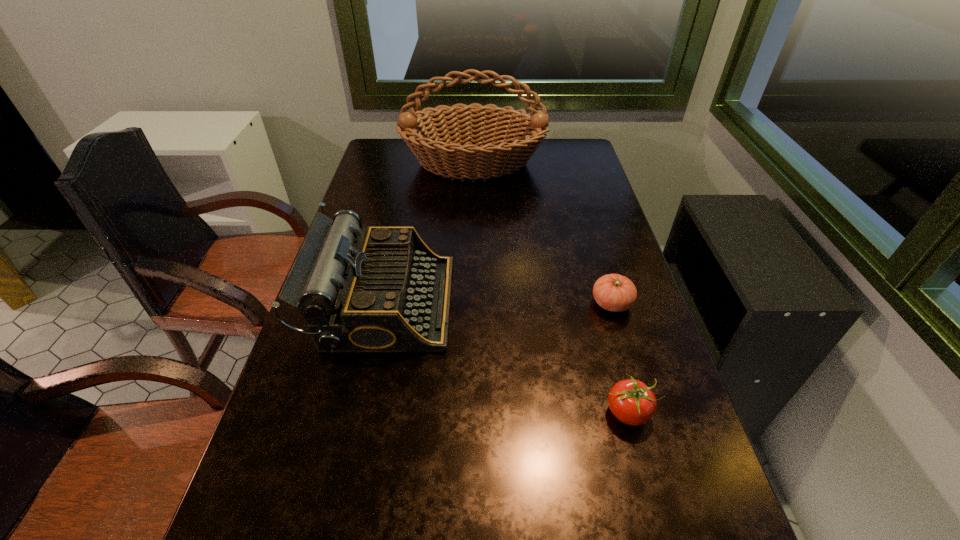
Identify the location of vacant region that satisfies the following two spatial constraints: 1. on the keyboard of the farther tomato; 2. on the right side of the typewriter. The image size is (960, 540). (383, 303).

The width and height of the screenshot is (960, 540). Find the location of `vacant space that satisfies the following two spatial constraints: 1. on the front side of the basket; 2. on the right side of the farther tomato`. vacant space that satisfies the following two spatial constraints: 1. on the front side of the basket; 2. on the right side of the farther tomato is located at coordinates (470, 303).

I want to click on vacant space that satisfies the following two spatial constraints: 1. on the keyboard of the nearest object; 2. on the left side of the typewriter, so click(359, 413).